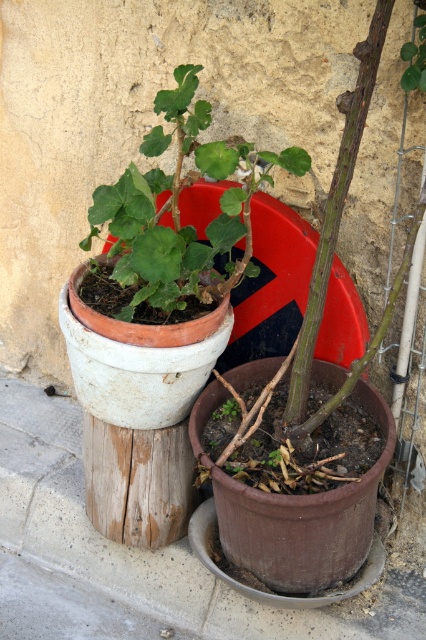
You are standing in front of the two potted plants in the scene. There are two points marked in the image. Point A is at coordinates point (250, 268) and Point B is at point (235, 412). Which point is closer to you?

Point A at point (250, 268) is closer to the camera than point B at point (235, 412).

Based on the photo, you are standing in front of the two potted plants in the scene. You notice a green matte leaf at center and a green matte plant at center. Which object is positioned to the right side?

The green matte leaf at center is positioned to the right of the green matte plant at center.

You are a gardener who wants to water both the green matte leaf at center and the green matte plant at center. Which one should you water first if you want to avoid getting water on the other?

You should water the green matte plant at center first because the green matte leaf at center is located above it. Watering the lower plant first will prevent water from dripping onto the leaf above.